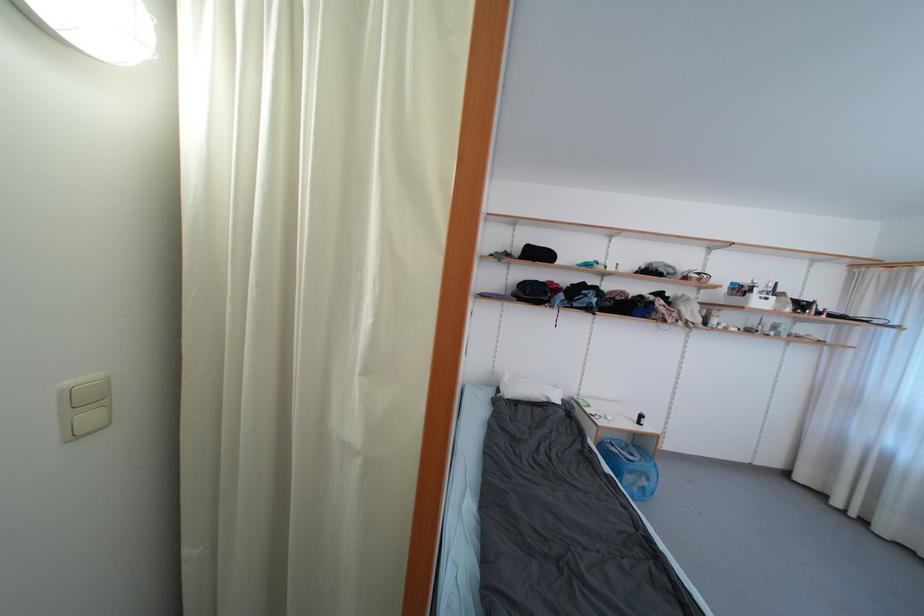
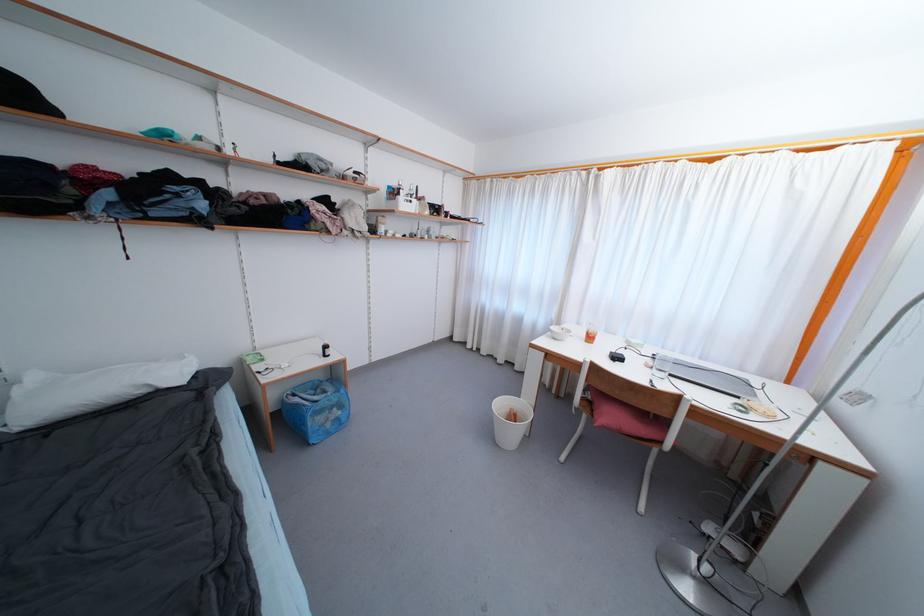
Where in the second image is the point corresponding to the point at 616,448 from the first image?

(298, 398)